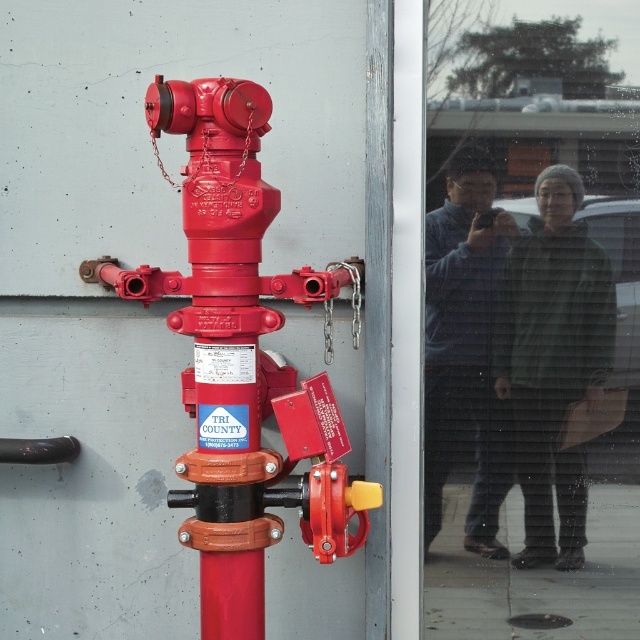
Looking at this image, you are a delivery person trying to enter the building through the transparent glass door at upper right. The matte red fire hydrant at center is blocking your path. Can you walk around it to reach the door?

The transparent glass door at upper right is below the matte red fire hydrant at center, meaning the hydrant is positioned above the door. Since the hydrant is mounted on the wall, it does not block the path to the door, so you can walk around it to reach the transparent glass door at upper right.

You are moving a rectangular box that is 1 meter wide. You want to carry it through the space between the transparent glass door at upper right and the matte red fire hydrant at center. Can the box fit through that space?

The transparent glass door at upper right is thinner than the matte red fire hydrant at center. The space between them is determined by the distance between their edges. Since the door is thinner, the available space between the two objects would be wider than the door itself. However, without specific measurements of the distance between them, we cannot definitively confirm if the 1 meter wide box can fit through. Additional information about the actual spacing between the transparent glass door at upper r

You are a delivery person trying to enter through the transparent glass door at upper right. You notice the matte red fire hydrant at center is blocking your path. Can you walk around it to reach the door?

The transparent glass door at upper right has a greater height compared to the matte red fire hydrant at center, but this detail does not affect the ability to walk around the hydrant. Since the hydrant is at the center and the door is to the right, you can walk around the hydrant to reach the door.